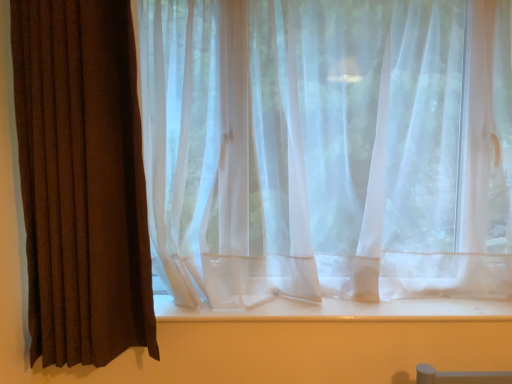
What do you see at coordinates (341, 310) in the screenshot? The width and height of the screenshot is (512, 384). I see `white smooth window sill at center` at bounding box center [341, 310].

In order to face translucent white curtain at center, which is the second curtain from left to right, should I rotate leftwards or rightwards?

Turn right by 11.171 degrees to look at translucent white curtain at center, which is the second curtain from left to right.

At what (x,y) coordinates should I click in order to perform the action: click on white smooth window sill at center. Please return your answer as a coordinate pair (x, y). This screenshot has width=512, height=384. Looking at the image, I should click on (341, 310).

From a real-world perspective, is brown textured curtain at left, placed as the 2th curtain when sorted from right to left, under white smooth window sill at center?

Incorrect, from a real-world perspective, brown textured curtain at left, placed as the 2th curtain when sorted from right to left, is higher than white smooth window sill at center.

Considering the positions of objects brown textured curtain at left, positioned as the 1th curtain in left-to-right order, and white smooth window sill at center in the image provided, who is behind, brown textured curtain at left, positioned as the 1th curtain in left-to-right order, or white smooth window sill at center?

white smooth window sill at center.

Between point (50, 108) and point (345, 311), which one is positioned in front?

The point (50, 108) is in front.

How many degrees apart are the facing directions of brown textured curtain at left, positioned as the 1th curtain in left-to-right order, and white smooth window sill at center?

0.00242 degrees separate the facing orientations of brown textured curtain at left, positioned as the 1th curtain in left-to-right order, and white smooth window sill at center.

Where is `curtain that is on the right side of brown textured curtain at left, placed as the 2th curtain when sorted from right to left`? curtain that is on the right side of brown textured curtain at left, placed as the 2th curtain when sorted from right to left is located at coordinates (328, 148).

Which of these two, brown textured curtain at left, positioned as the 1th curtain in left-to-right order, or translucent white curtain at center, positioned as the 1th curtain in right-to-left order, stands taller?

brown textured curtain at left, positioned as the 1th curtain in left-to-right order.

How different are the orientations of brown textured curtain at left, placed as the 2th curtain when sorted from right to left, and translucent white curtain at center, positioned as the 1th curtain in right-to-left order, in degrees?

The angle between the facing direction of brown textured curtain at left, placed as the 2th curtain when sorted from right to left, and the facing direction of translucent white curtain at center, positioned as the 1th curtain in right-to-left order, is 0.358 degrees.

Can you confirm if brown textured curtain at left, positioned as the 1th curtain in left-to-right order, is wider than translucent white curtain at center, which is the second curtain from left to right?

In fact, brown textured curtain at left, positioned as the 1th curtain in left-to-right order, might be narrower than translucent white curtain at center, which is the second curtain from left to right.

Would you consider translucent white curtain at center, which is the second curtain from left to right, to be distant from white smooth window sill at center?

translucent white curtain at center, which is the second curtain from left to right, is actually quite close to white smooth window sill at center.

From a real-world perspective, who is located higher, translucent white curtain at center, positioned as the 1th curtain in right-to-left order, or white smooth window sill at center?

translucent white curtain at center, positioned as the 1th curtain in right-to-left order.

From the image's perspective, is translucent white curtain at center, which is the second curtain from left to right, positioned above or below white smooth window sill at center?

From the image's perspective, translucent white curtain at center, which is the second curtain from left to right, appears above white smooth window sill at center.

Choose the correct answer: Is translucent white curtain at center, positioned as the 1th curtain in right-to-left order, inside white smooth window sill at center or outside it?

translucent white curtain at center, positioned as the 1th curtain in right-to-left order, exists outside the volume of white smooth window sill at center.

Can you confirm if translucent white curtain at center, positioned as the 1th curtain in right-to-left order, is thinner than brown textured curtain at left, placed as the 2th curtain when sorted from right to left?

Incorrect, the width of translucent white curtain at center, positioned as the 1th curtain in right-to-left order, is not less than that of brown textured curtain at left, placed as the 2th curtain when sorted from right to left.

Is point (228, 238) positioned in front of point (130, 265)?

No.

Based on their sizes in the image, would you say translucent white curtain at center, which is the second curtain from left to right, is bigger or smaller than brown textured curtain at left, positioned as the 1th curtain in left-to-right order?

Considering their sizes, translucent white curtain at center, which is the second curtain from left to right, takes up more space than brown textured curtain at left, positioned as the 1th curtain in left-to-right order.

Is there a large distance between translucent white curtain at center, which is the second curtain from left to right, and brown textured curtain at left, placed as the 2th curtain when sorted from right to left?

No.

Locate an element on the screen. The height and width of the screenshot is (384, 512). curtain on the left side of white smooth window sill at center is located at coordinates (82, 181).

Does white smooth window sill at center lie in front of brown textured curtain at left, positioned as the 1th curtain in left-to-right order?

That is False.

Is point (399, 305) more distant than point (36, 162)?

Yes, point (399, 305) is behind point (36, 162).

Considering the sizes of objects white smooth window sill at center and brown textured curtain at left, placed as the 2th curtain when sorted from right to left, in the image provided, who is taller, white smooth window sill at center or brown textured curtain at left, placed as the 2th curtain when sorted from right to left,?

With more height is brown textured curtain at left, placed as the 2th curtain when sorted from right to left.

Is point (449, 301) closer or farther from the camera than point (337, 112)?

Point (449, 301) is positioned farther from the camera compared to point (337, 112).

Is white smooth window sill at center not near translucent white curtain at center, which is the second curtain from left to right?

Actually, white smooth window sill at center and translucent white curtain at center, which is the second curtain from left to right, are a little close together.

From a real-world perspective, who is located lower, white smooth window sill at center or translucent white curtain at center, which is the second curtain from left to right?

From a 3D spatial view, white smooth window sill at center is below.

From the image's perspective, is white smooth window sill at center positioned above or below translucent white curtain at center, positioned as the 1th curtain in right-to-left order?

white smooth window sill at center is situated lower than translucent white curtain at center, positioned as the 1th curtain in right-to-left order, in the image.

Find the location of a particular element. The height and width of the screenshot is (384, 512). window sill on the right side of brown textured curtain at left, placed as the 2th curtain when sorted from right to left is located at coordinates (341, 310).

At what (x,y) coordinates should I click in order to perform the action: click on curtain below the translucent white curtain at center, positioned as the 1th curtain in right-to-left order (from the image's perspective). Please return your answer as a coordinate pair (x, y). Looking at the image, I should click on (82, 181).

Estimate the real-world distances between objects in this image. Which object is closer to translucent white curtain at center, which is the second curtain from left to right, brown textured curtain at left, positioned as the 1th curtain in left-to-right order, or white smooth window sill at center?

white smooth window sill at center is closer to translucent white curtain at center, which is the second curtain from left to right.

Considering their positions, is brown textured curtain at left, placed as the 2th curtain when sorted from right to left, positioned closer to white smooth window sill at center than translucent white curtain at center, which is the second curtain from left to right?

Among the two, translucent white curtain at center, which is the second curtain from left to right, is located nearer to white smooth window sill at center.

Considering their positions, is white smooth window sill at center positioned closer to brown textured curtain at left, positioned as the 1th curtain in left-to-right order, than translucent white curtain at center, which is the second curtain from left to right?

translucent white curtain at center, which is the second curtain from left to right, lies closer to brown textured curtain at left, positioned as the 1th curtain in left-to-right order, than the other object.

Which object lies nearer to the anchor point translucent white curtain at center, positioned as the 1th curtain in right-to-left order, white smooth window sill at center or brown textured curtain at left, positioned as the 1th curtain in left-to-right order?

white smooth window sill at center is closer to translucent white curtain at center, positioned as the 1th curtain in right-to-left order.

In the scene shown: When comparing their distances from white smooth window sill at center, does translucent white curtain at center, which is the second curtain from left to right, or brown textured curtain at left, positioned as the 1th curtain in left-to-right order, seem further?

brown textured curtain at left, positioned as the 1th curtain in left-to-right order.

Considering their positions, is translucent white curtain at center, which is the second curtain from left to right, positioned closer to brown textured curtain at left, positioned as the 1th curtain in left-to-right order, than white smooth window sill at center?

The object closer to brown textured curtain at left, positioned as the 1th curtain in left-to-right order, is translucent white curtain at center, which is the second curtain from left to right.

Identify the location of window sill between brown textured curtain at left, placed as the 2th curtain when sorted from right to left, and translucent white curtain at center, which is the second curtain from left to right, from left to right. The height and width of the screenshot is (384, 512). (341, 310).